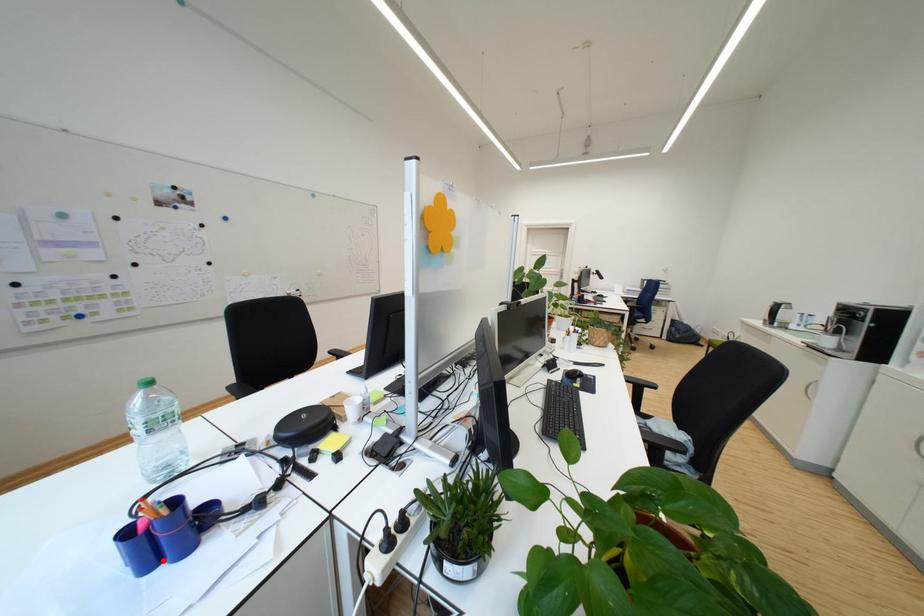
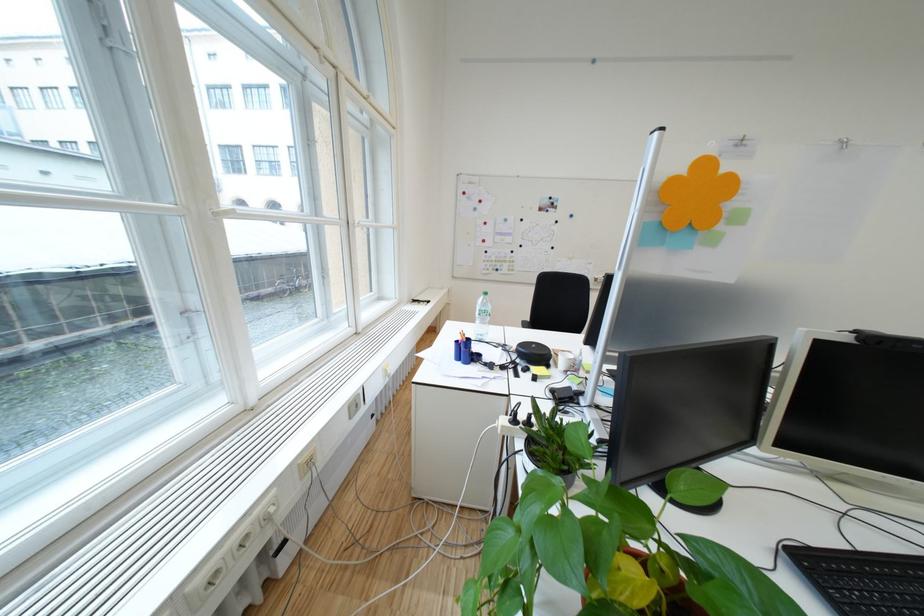
The point at the highlighted location is marked in the first image. Where is the corresponding point in the second image?

(470, 359)